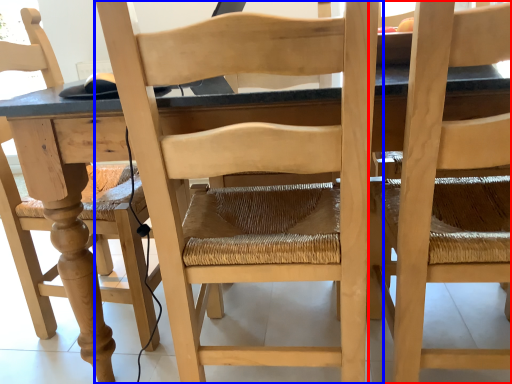
Question: Which of the following is the farthest to the observer, chair (highlighted by a red box) or chair (highlighted by a blue box)?

Choices:
 (A) chair
 (B) chair

Answer: (B)